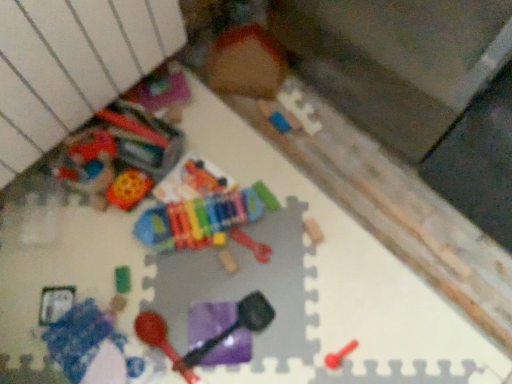
Question: From the image's perspective, is blue fabric blanket at lower left, which ranks as the 7th toy in right-to-left order, above smooth plastic spoon at lower right, arranged as the first toy when viewed from the right?

Choices:
 (A) no
 (B) yes

Answer: (A)

Question: Is blue fabric blanket at lower left, which ranks as the 7th toy in right-to-left order, positioned in front of smooth plastic spoon at lower right, arranged as the first toy when viewed from the right?

Choices:
 (A) no
 (B) yes

Answer: (B)

Question: Considering the relative positions of blue fabric blanket at lower left, positioned as the first toy in left-to-right order, and smooth plastic spoon at lower right, the seventh toy in the left-to-right sequence, in the image provided, is blue fabric blanket at lower left, positioned as the first toy in left-to-right order, to the left of smooth plastic spoon at lower right, the seventh toy in the left-to-right sequence, from the viewer's perspective?

Choices:
 (A) no
 (B) yes

Answer: (B)

Question: From the image's perspective, is blue fabric blanket at lower left, positioned as the first toy in left-to-right order, below smooth plastic spoon at lower right, arranged as the first toy when viewed from the right?

Choices:
 (A) no
 (B) yes

Answer: (B)

Question: Can you confirm if blue fabric blanket at lower left, positioned as the first toy in left-to-right order, is smaller than smooth plastic spoon at lower right, the seventh toy in the left-to-right sequence?

Choices:
 (A) yes
 (B) no

Answer: (B)

Question: Is blue fabric blanket at lower left, positioned as the first toy in left-to-right order, taller than smooth plastic spoon at lower right, the seventh toy in the left-to-right sequence?

Choices:
 (A) no
 (B) yes

Answer: (B)

Question: Is wooden xylophone at center, which ranks as the fourth toy in right-to-left order, at the back of purple matte shovel at center, the third toy positioned from the right?

Choices:
 (A) yes
 (B) no

Answer: (A)

Question: Is purple matte shovel at center, which is the fifth toy in left-to-right order, shorter than wooden xylophone at center, which is the 4th toy from left to right?

Choices:
 (A) no
 (B) yes

Answer: (A)

Question: Is purple matte shovel at center, which is the fifth toy in left-to-right order, positioned far away from wooden xylophone at center, which ranks as the fourth toy in right-to-left order?

Choices:
 (A) no
 (B) yes

Answer: (A)

Question: Considering the relative sizes of purple matte shovel at center, which is the fifth toy in left-to-right order, and wooden xylophone at center, which ranks as the fourth toy in right-to-left order, in the image provided, is purple matte shovel at center, which is the fifth toy in left-to-right order, taller than wooden xylophone at center, which ranks as the fourth toy in right-to-left order,?

Choices:
 (A) yes
 (B) no

Answer: (A)

Question: Does purple matte shovel at center, which is the fifth toy in left-to-right order, have a smaller size compared to wooden xylophone at center, which ranks as the fourth toy in right-to-left order?

Choices:
 (A) yes
 (B) no

Answer: (B)

Question: Does purple matte shovel at center, which is the fifth toy in left-to-right order, touch wooden xylophone at center, which is the 4th toy from left to right?

Choices:
 (A) no
 (B) yes

Answer: (A)

Question: Can you confirm if rubber bone at center, the 2th toy viewed from the right, is thinner than rubberized plastic maraca at lower center, arranged as the 6th toy when viewed from the right?

Choices:
 (A) yes
 (B) no

Answer: (A)